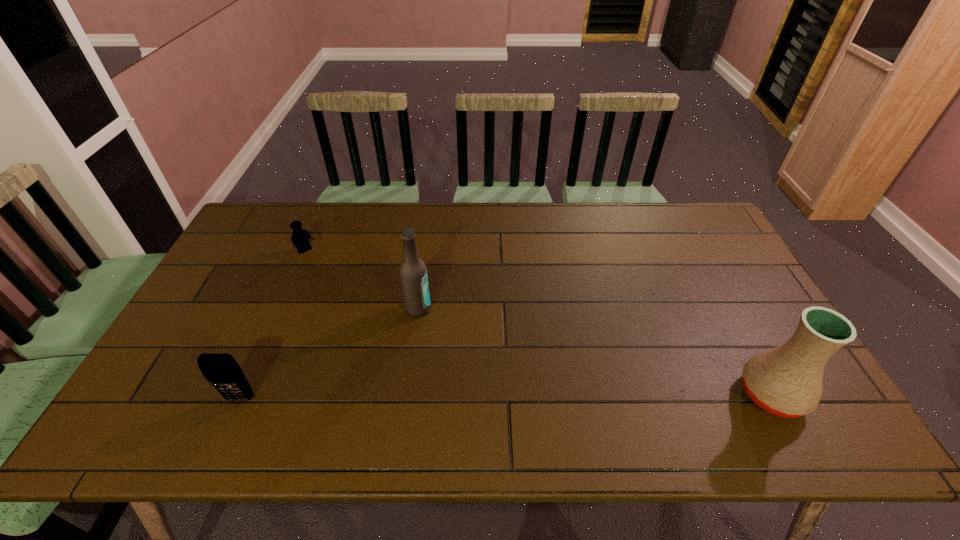
Locate an element on the screen. This screenshot has height=540, width=960. vacant space at the right edge of the desktop is located at coordinates (723, 249).

In order to click on vacant space at the far left corner of the desktop in this screenshot , I will do `click(247, 232)`.

You are a GUI agent. You are given a task and a screenshot of the screen. Output one action in this format:
    pyautogui.click(x=<x>, y=<y>)
    Task: Click on the vacant space that is in between the second object from right to left and the farthest object
    The image size is (960, 540).
    Given the screenshot: What is the action you would take?
    pyautogui.click(x=363, y=280)

Identify the location of vacant point located between the pottery and the third object from left to right. The width and height of the screenshot is (960, 540). (595, 352).

Where is `free space that is in between the pottery and the beer bottle`? Image resolution: width=960 pixels, height=540 pixels. free space that is in between the pottery and the beer bottle is located at coordinates (595, 352).

Find the location of `unoccupied position between the farthest object and the second shortest object`. unoccupied position between the farthest object and the second shortest object is located at coordinates (274, 325).

Find the location of `vacant area between the shortest object and the pottery`. vacant area between the shortest object and the pottery is located at coordinates (539, 323).

This screenshot has width=960, height=540. I want to click on empty location between the pottery and the beer bottle, so click(595, 352).

Image resolution: width=960 pixels, height=540 pixels. What are the coordinates of `free point between the pottery and the beer bottle` in the screenshot? It's located at (595, 352).

Find the location of `vacant area that lies between the beer bottle and the third tallest object`. vacant area that lies between the beer bottle and the third tallest object is located at coordinates (329, 354).